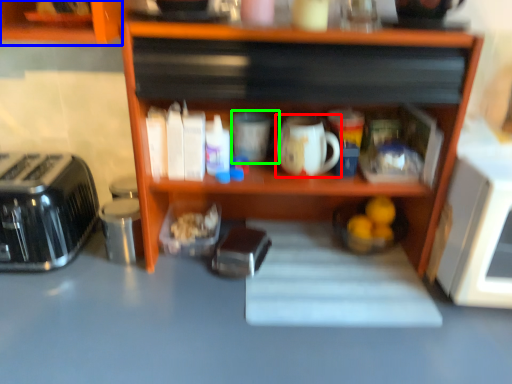
Question: Which is farther away from coffee cup (highlighted by a red box)? cabinetry (highlighted by a blue box) or mug (highlighted by a green box)?

Choices:
 (A) cabinetry
 (B) mug

Answer: (A)